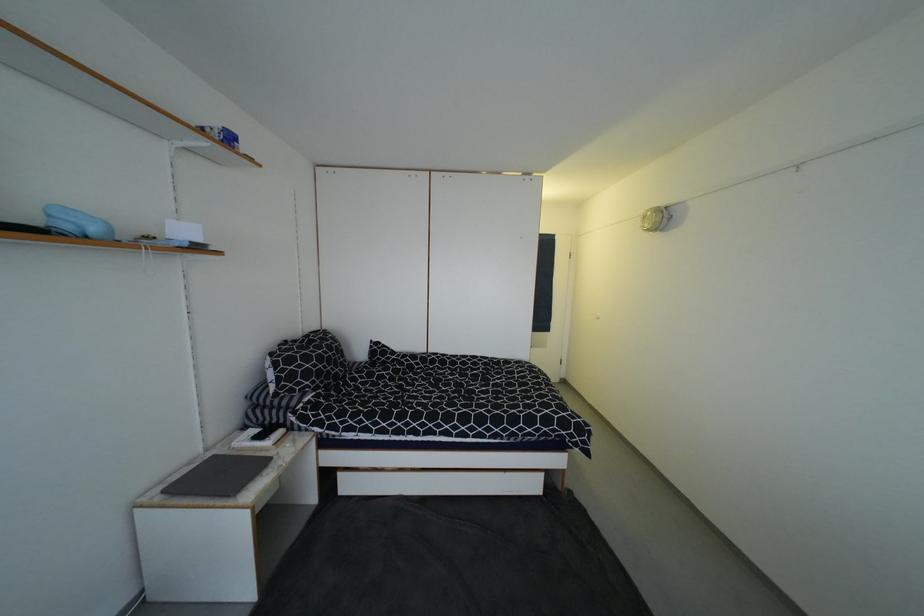
At what (x,y) coordinates should I click in order to perform the action: click on closed grey laptop. Please return your answer as a coordinate pair (x, y). The image size is (924, 616). Looking at the image, I should click on (217, 476).